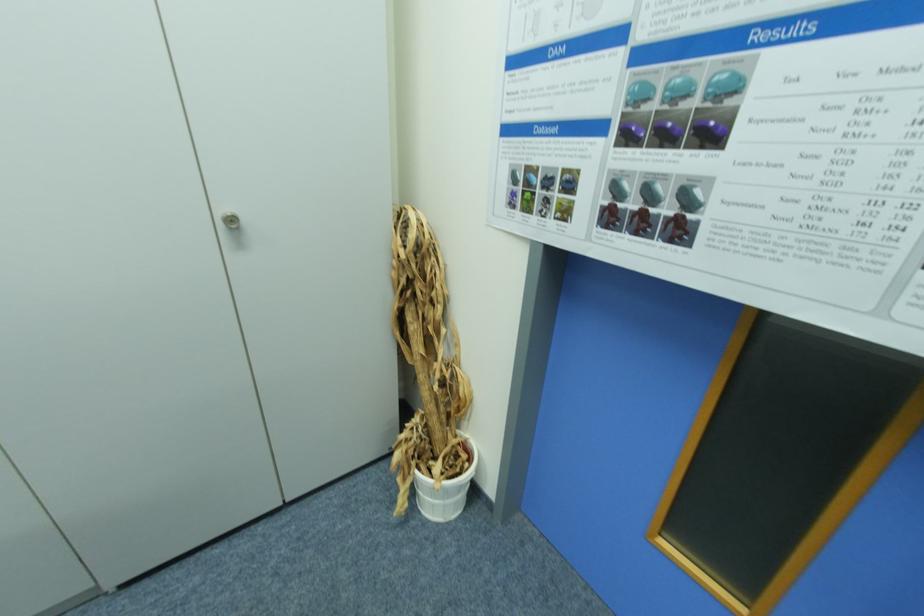
Where would you pull the cabinet knob? Please return your answer as a coordinate pair (x, y).

(229, 220)